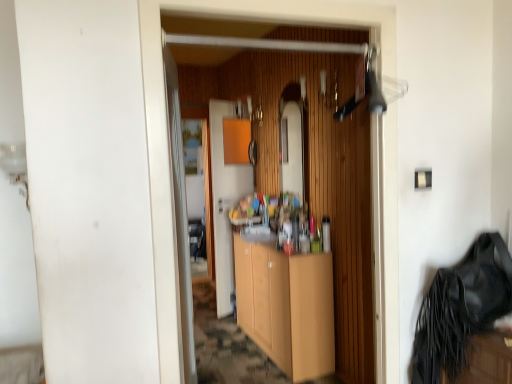
Question: Is wooden cabinet at center bigger or smaller than light wood cabinet at center?

Choices:
 (A) small
 (B) big

Answer: (A)

Question: Is wooden cabinet at center in front of or behind light wood cabinet at center in the image?

Choices:
 (A) behind
 (B) front

Answer: (A)

Question: From a real-world perspective, is wooden cabinet at center above or below light wood cabinet at center?

Choices:
 (A) above
 (B) below

Answer: (A)

Question: Which is correct: light wood cabinet at center is inside wooden cabinet at center, or outside of it?

Choices:
 (A) inside
 (B) outside

Answer: (B)

Question: From their relative heights in the image, would you say light wood cabinet at center is taller or shorter than wooden cabinet at center?

Choices:
 (A) short
 (B) tall

Answer: (A)

Question: Considering their positions, is light wood cabinet at center located in front of or behind wooden cabinet at center?

Choices:
 (A) front
 (B) behind

Answer: (A)

Question: Considering the positions of light wood cabinet at center and wooden cabinet at center in the image, is light wood cabinet at center wider or thinner than wooden cabinet at center?

Choices:
 (A) wide
 (B) thin

Answer: (A)